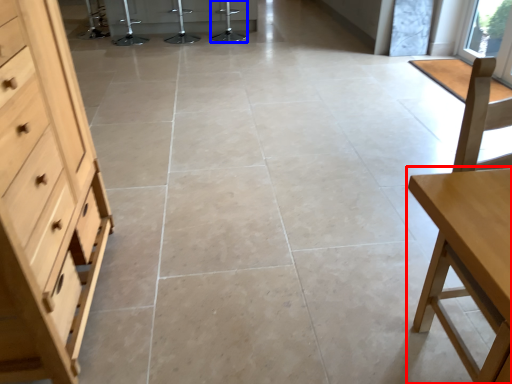
Question: Which object is closer to the camera taking this photo, table (highlighted by a red box) or bar stool (highlighted by a blue box)?

Choices:
 (A) table
 (B) bar stool

Answer: (A)